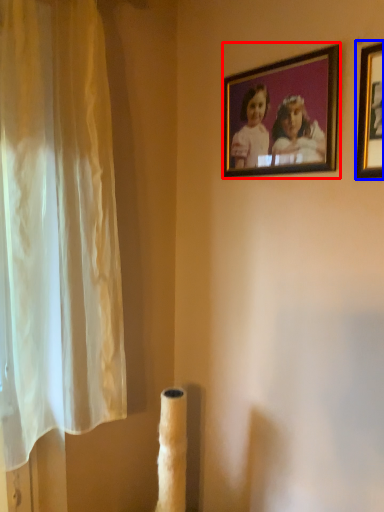
Question: Which object appears farthest to the camera in this image, picture frame (highlighted by a red box) or picture frame (highlighted by a blue box)?

Choices:
 (A) picture frame
 (B) picture frame

Answer: (A)